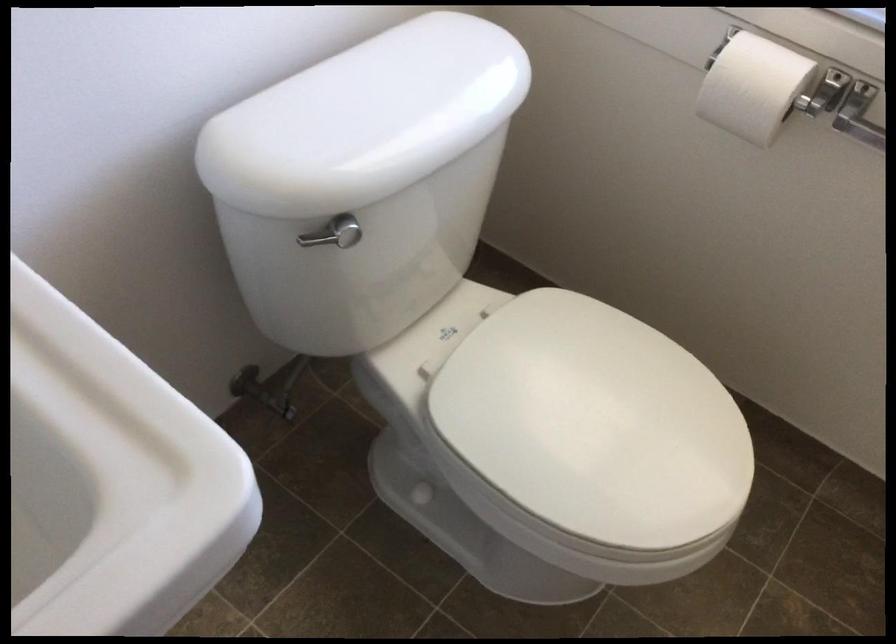
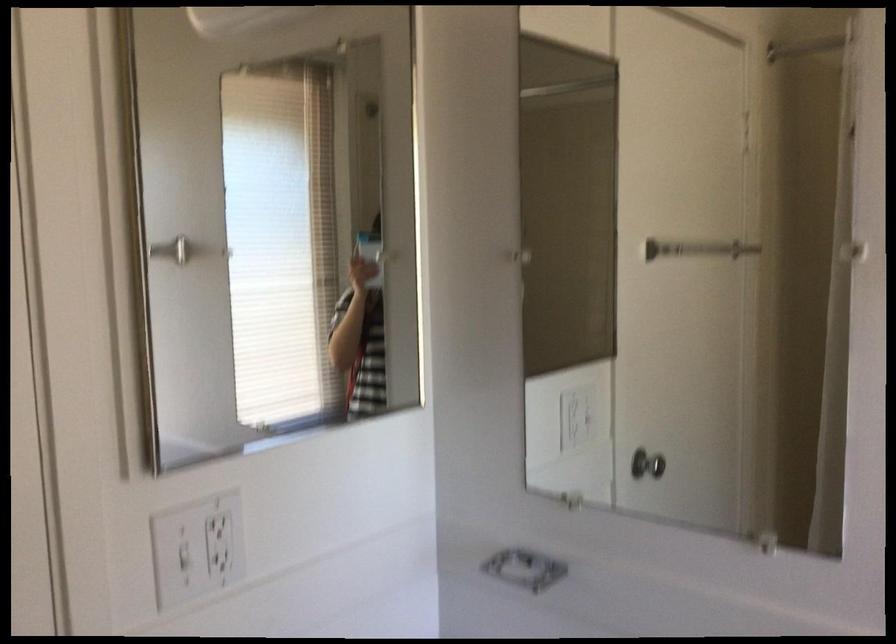
Question: The camera is either moving clockwise (left) or counter-clockwise (right) around the object. The first image is from the beginning of the video and the second image is from the end. Is the camera moving left or right when shooting the video?

Choices:
 (A) Left
 (B) Right

Answer: (B)